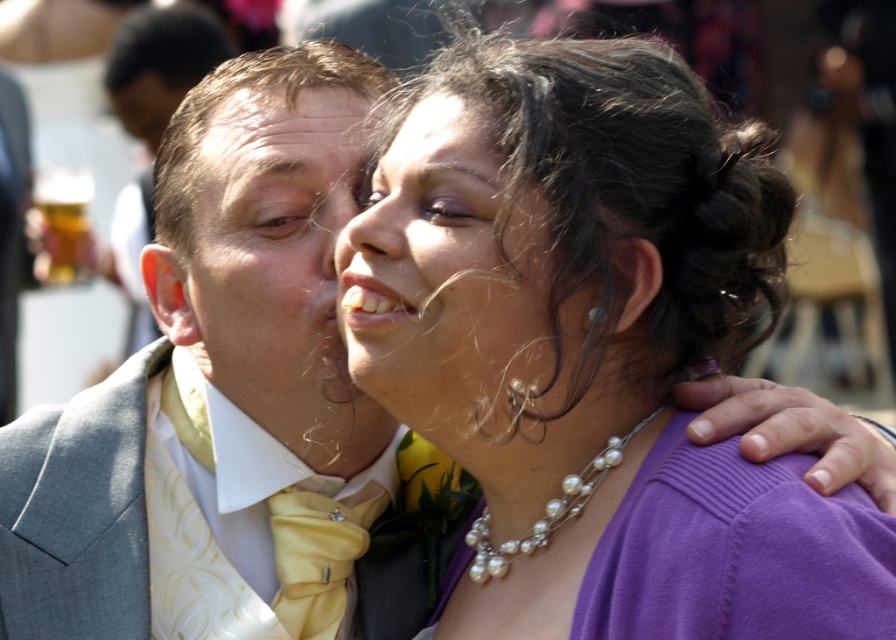
Question: Does purple fabric at center have a greater width compared to matte gray suit at left?

Choices:
 (A) yes
 (B) no

Answer: (B)

Question: Which point appears closest to the camera in this image?

Choices:
 (A) (308, 412)
 (B) (418, 209)
 (C) (312, 532)

Answer: (B)

Question: Is matte gray suit at left to the right of matte yellow bow tie at left from the viewer's perspective?

Choices:
 (A) no
 (B) yes

Answer: (A)

Question: Among these points, which one is nearest to the camera?

Choices:
 (A) (169, 307)
 (B) (521, 556)

Answer: (B)

Question: Considering the relative positions of purple fabric at center and matte gray suit at left in the image provided, where is purple fabric at center located with respect to matte gray suit at left?

Choices:
 (A) right
 (B) left

Answer: (A)

Question: Which point is closer to the camera?

Choices:
 (A) (652, 413)
 (B) (326, 620)

Answer: (A)